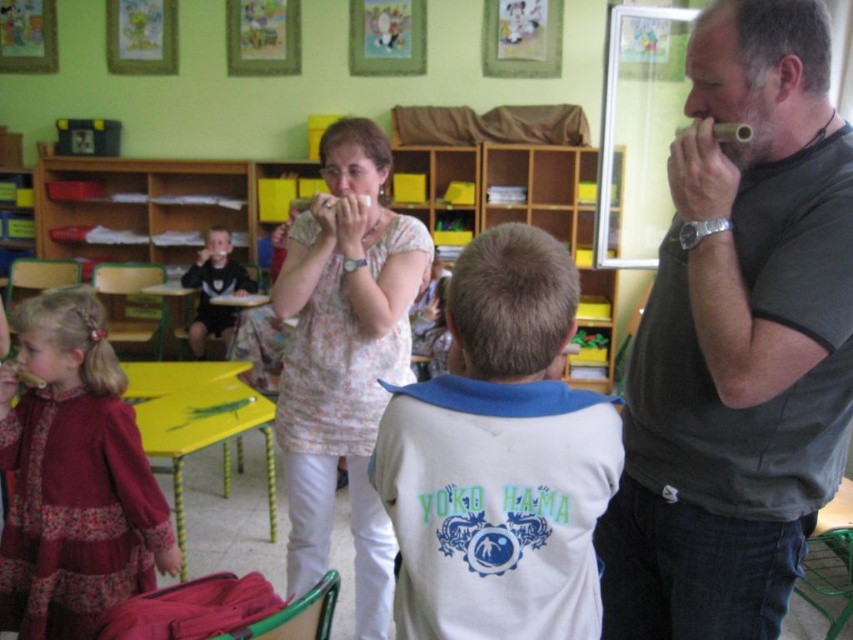
Question: Which point is closer to the camera?

Choices:
 (A) floral fabric blouse at center
 (B) maroon fabric dress at left

Answer: (B)

Question: Which point is farther from the camera taking this photo?

Choices:
 (A) (222, 273)
 (B) (22, 536)
 (C) (373, 611)
 (D) (796, 230)

Answer: (A)

Question: Can you confirm if dark gray t-shirt at right is smaller than black matte shirt at left?

Choices:
 (A) yes
 (B) no

Answer: (B)

Question: Which point is closer to the camera?

Choices:
 (A) (299, 324)
 (B) (225, 312)

Answer: (A)

Question: Does floral fabric blouse at center appear on the left side of black matte shirt at left?

Choices:
 (A) no
 (B) yes

Answer: (A)

Question: Does dark gray t-shirt at right have a smaller size compared to white cotton shirt at center?

Choices:
 (A) yes
 (B) no

Answer: (B)